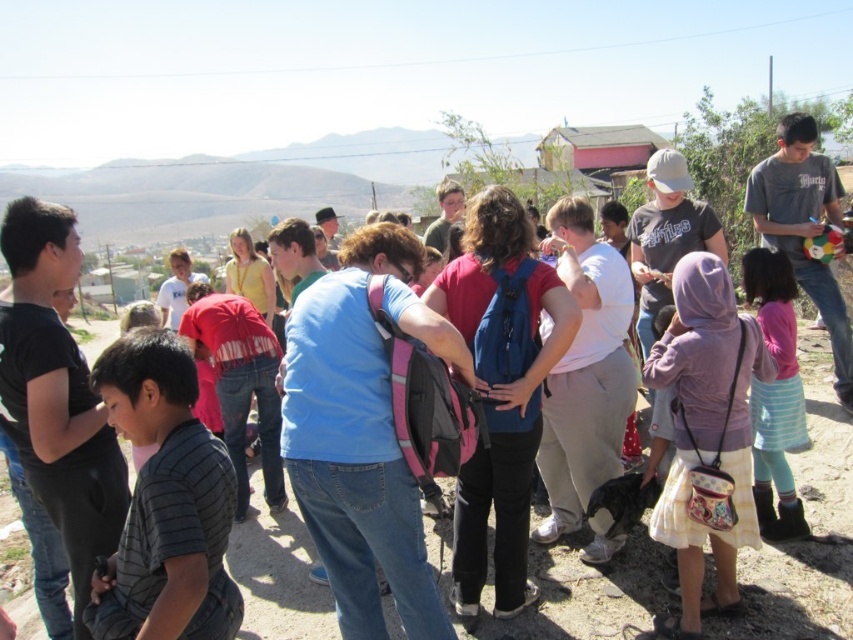
Question: Does striped cotton shirt at lower left appear under pink fabric dress at lower right?

Choices:
 (A) no
 (B) yes

Answer: (B)

Question: Among these objects, which one is farthest from the camera?

Choices:
 (A) pink fabric dress at lower right
 (B) striped cotton shirt at lower left
 (C) purple fabric purse at center

Answer: (A)

Question: Does striped cotton shirt at lower left lie in front of pink fabric dress at lower right?

Choices:
 (A) yes
 (B) no

Answer: (A)

Question: Based on their relative distances, which object is farther from the purple fabric purse at center?

Choices:
 (A) striped cotton shirt at lower left
 (B) pink fabric dress at lower right

Answer: (A)

Question: Observing the image, what is the correct spatial positioning of striped cotton shirt at lower left in reference to purple fabric purse at center?

Choices:
 (A) left
 (B) right

Answer: (A)

Question: Which of the following is the closest to the observer?

Choices:
 (A) (202, 445)
 (B) (761, 262)
 (C) (683, 426)

Answer: (A)